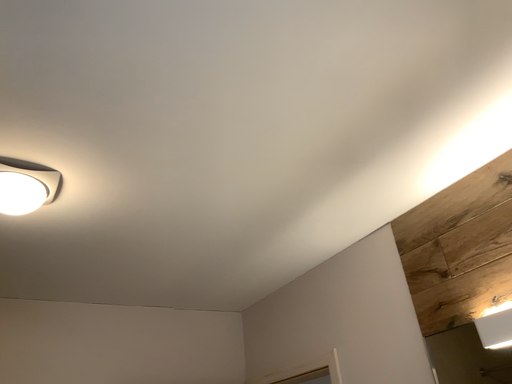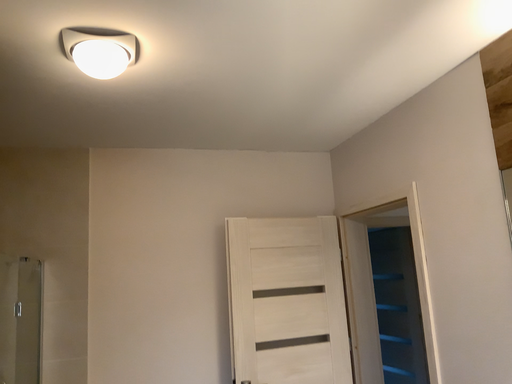
Question: Which way did the camera rotate in the video?

Choices:
 (A) rotated downward
 (B) rotated upward

Answer: (A)